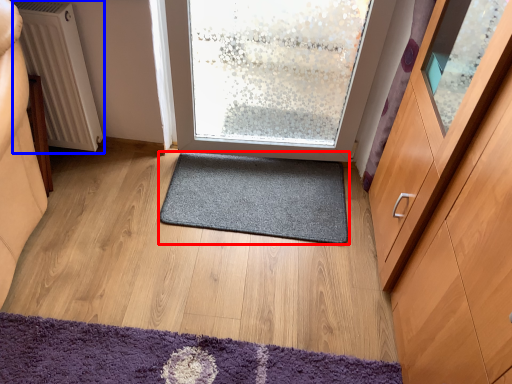
Question: Which object is closer to the camera taking this photo, mat (highlighted by a red box) or radiator (highlighted by a blue box)?

Choices:
 (A) mat
 (B) radiator

Answer: (B)